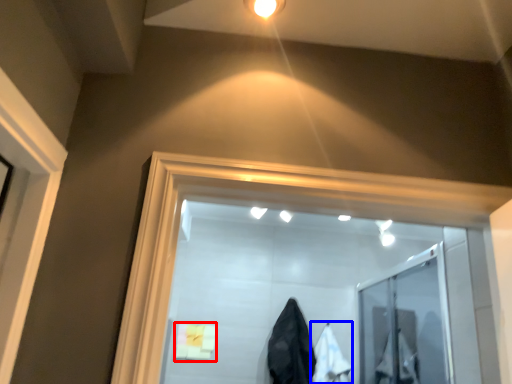
Question: Which point is closer to the camera, bath towel (highlighted by a red box) or garment (highlighted by a blue box)?

Choices:
 (A) bath towel
 (B) garment

Answer: (B)